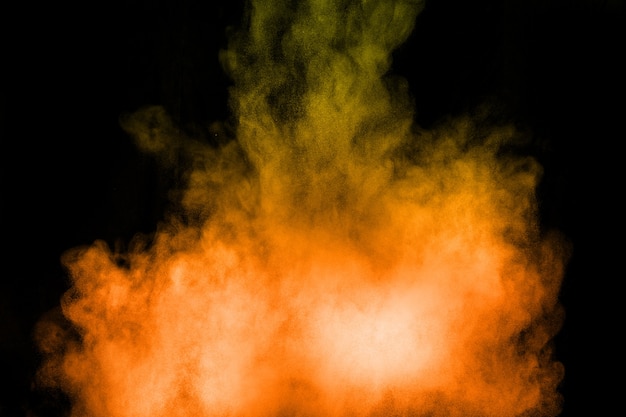
This screenshot has height=417, width=626. In order to click on top edge of picture in this screenshot , I will do `click(49, 1)`, `click(590, 0)`.